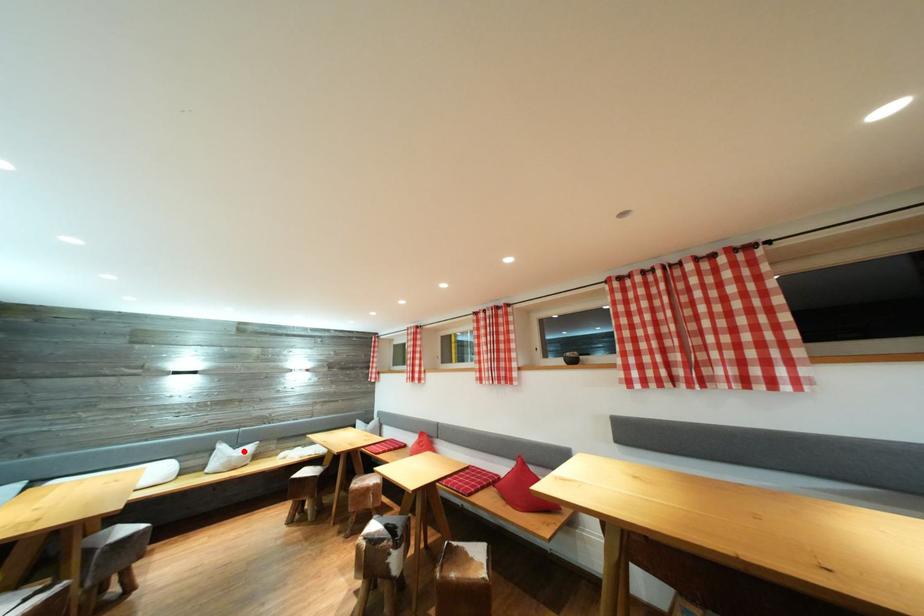
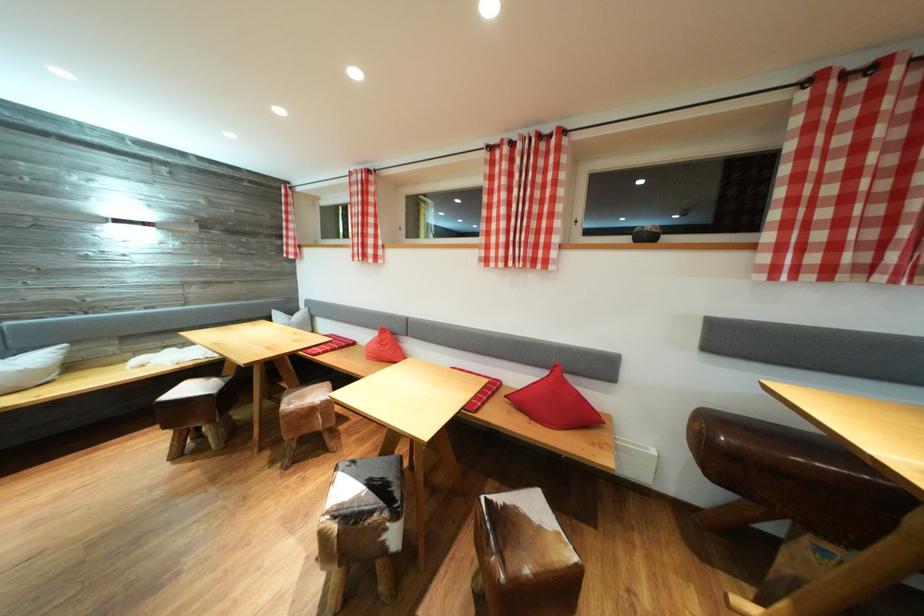
In the second image, find the point that corresponds to the highlighted location in the first image.

(14, 358)